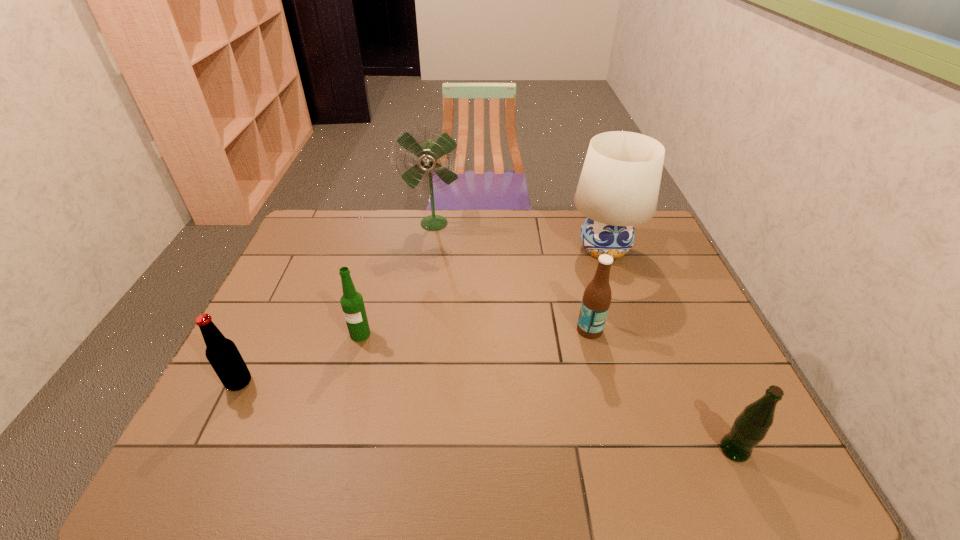
The height and width of the screenshot is (540, 960). What are the coordinates of `object that is at the far right corner` in the screenshot? It's located at (618, 188).

This screenshot has width=960, height=540. I want to click on object present at the near right corner, so click(x=750, y=427).

This screenshot has width=960, height=540. In the image, there is a desktop. What are the coordinates of `vacant region at the far edge` in the screenshot? It's located at (525, 244).

Image resolution: width=960 pixels, height=540 pixels. Find the location of `vacant space at the near edge of the desktop`. vacant space at the near edge of the desktop is located at coordinates (676, 480).

In the image, there is a desktop. Where is `vacant area at the right edge`? vacant area at the right edge is located at coordinates (701, 413).

Image resolution: width=960 pixels, height=540 pixels. In order to click on empty location between the second object from left to right and the nearest object in this screenshot , I will do `click(547, 392)`.

Where is `vacant area between the lampshade and the rightmost beer bottle`? vacant area between the lampshade and the rightmost beer bottle is located at coordinates (669, 349).

Locate an element on the screen. The height and width of the screenshot is (540, 960). free spot between the second nearest object and the lampshade is located at coordinates (421, 315).

Image resolution: width=960 pixels, height=540 pixels. Identify the location of free space between the lampshade and the second object from left to right. (482, 292).

Where is `unoccupied position between the fifth object from right to left and the lampshade`? The height and width of the screenshot is (540, 960). unoccupied position between the fifth object from right to left and the lampshade is located at coordinates (482, 292).